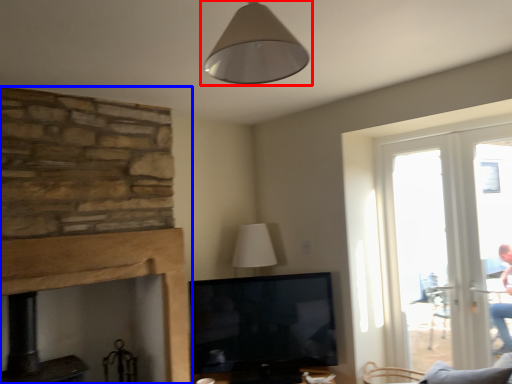
Question: Which object appears closest to the camera in this image, lamp (highlighted by a red box) or fireplace (highlighted by a blue box)?

Choices:
 (A) lamp
 (B) fireplace

Answer: (A)